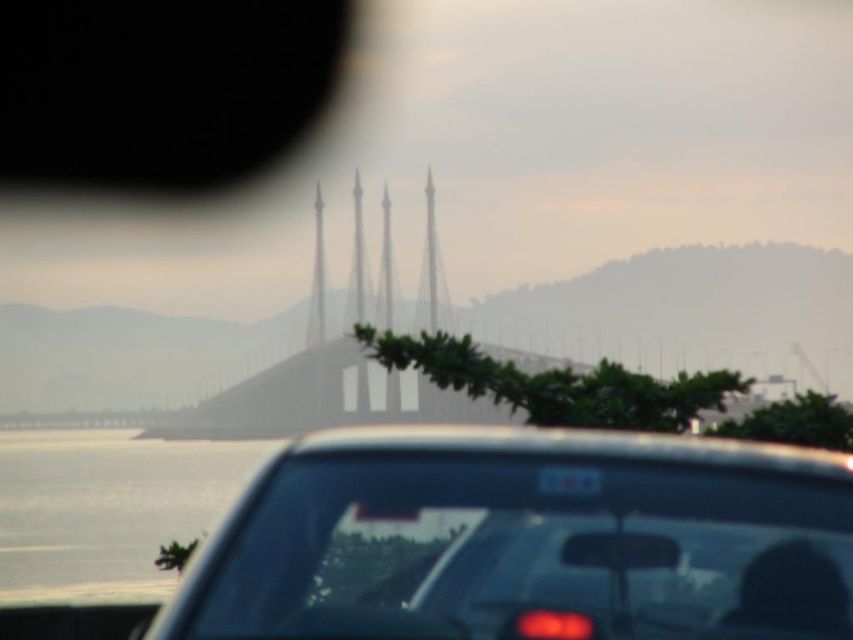
You are standing at the viewpoint where the image was taken and want to know which of the two points, point (148, 483) or point (561, 481), is closer to you. Can you determine this based on their positions?

Point (148, 483) is closer to you because it is further to the camera than point (561, 481).

You are a photographer planning to capture the matte black car at center and the clear water at lower left in a single frame. Based on their widths, which object should you position closer to the center of your camera frame to ensure both fit well?

Since the matte black car at center is narrower than the clear water at lower left, you should position the matte black car at center closer to the center of your camera frame to ensure both fit well.